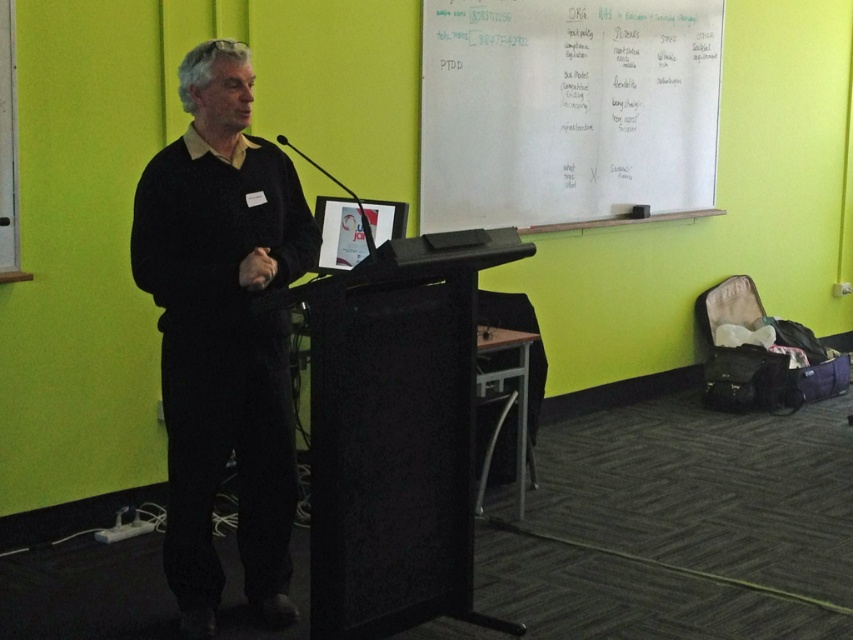
The image size is (853, 640). What do you see at coordinates (566, 109) in the screenshot?
I see `whiteboard at upper center` at bounding box center [566, 109].

Does whiteboard at upper center appear on the right side of black matte podium at center?

Yes, whiteboard at upper center is to the right of black matte podium at center.

Does point (492, 141) come closer to viewer compared to point (392, 385)?

No.

Identify the location of whiteboard at upper center. (566, 109).

Who is shorter, black matte sweater at left or whiteboard at upper center?

Standing shorter between the two is whiteboard at upper center.

Between black matte sweater at left and whiteboard at upper center, which one is positioned lower?

black matte sweater at left

Is point (181, 424) closer to viewer compared to point (599, 124)?

Yes, it is.

Where is `black matte sweater at left`? black matte sweater at left is located at coordinates (223, 332).

This screenshot has width=853, height=640. Describe the element at coordinates (223, 332) in the screenshot. I see `black matte sweater at left` at that location.

Does black matte sweater at left have a greater width compared to black matte podium at center?

No, black matte sweater at left is not wider than black matte podium at center.

Identify the location of black matte sweater at left. The width and height of the screenshot is (853, 640). (223, 332).